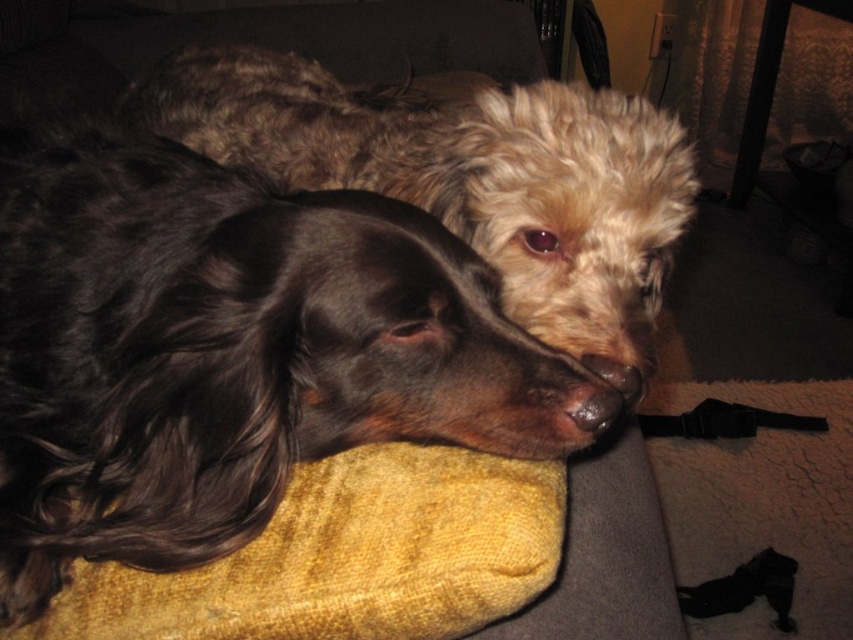
Question: Which object appears farthest from the camera in this image?

Choices:
 (A) brown matte nose at center
 (B) shiny black coat at center
 (C) black smooth nose at lower center

Answer: (A)

Question: Is shiny brown fur at center in front of black smooth nose at lower center?

Choices:
 (A) no
 (B) yes

Answer: (A)

Question: Is shiny brown fur at center closer to the viewer compared to brown matte nose at center?

Choices:
 (A) no
 (B) yes

Answer: (A)

Question: Is shiny brown fur at center to the left of black smooth nose at lower center from the viewer's perspective?

Choices:
 (A) yes
 (B) no

Answer: (A)

Question: Among these points, which one is farthest from the camera?

Choices:
 (A) (612, 364)
 (B) (619, 396)
 (C) (514, 118)
 (D) (379, 330)

Answer: (C)

Question: Which object is closer to the camera taking this photo?

Choices:
 (A) brown matte nose at center
 (B) shiny brown fur at center

Answer: (A)